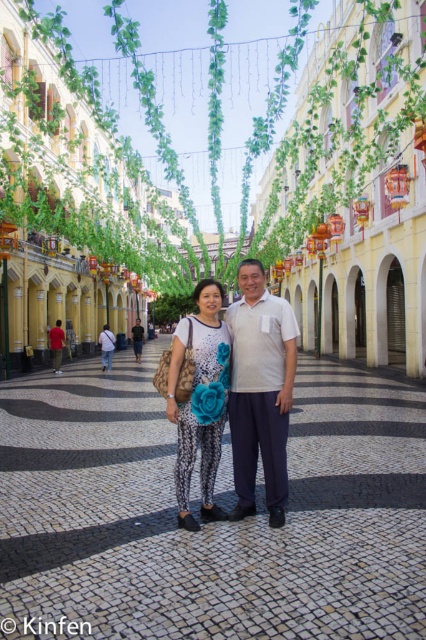
You are a photographer standing on the street and want to capture both the white cotton shirt at center and the matte white shirt at center in your shot. Which shirt should you focus on first if you want to ensure both are in frame without moving the camera?

The white cotton shirt at center is much taller than the matte white shirt at center, so focusing on the taller one first ensures both are within the frame.

You are a photographer positioned at the entrance of the street scene. You notice two items in the center of the image, the printed fabric leggings at center and the red cotton shirt at center. Which item is closer to your camera lens?

The printed fabric leggings at center is in front of the red cotton shirt at center, so the printed fabric leggings at center is closer to the camera lens.